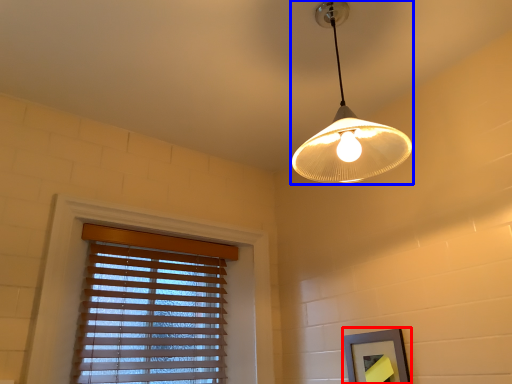
Question: Which of the following is the farthest to the observer, picture frame (highlighted by a red box) or lamp (highlighted by a blue box)?

Choices:
 (A) picture frame
 (B) lamp

Answer: (A)